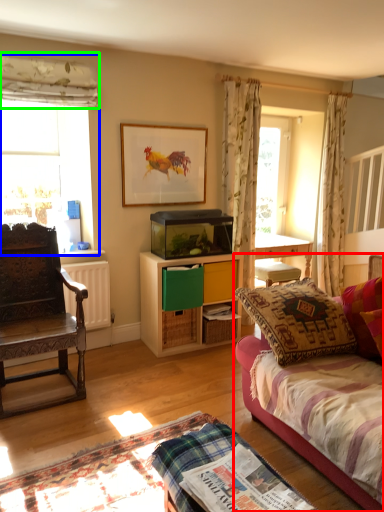
Question: Which object is the farthest from studio couch (highlighted by a red box)? Choose among these: window (highlighted by a blue box) or curtain (highlighted by a green box).

Choices:
 (A) window
 (B) curtain

Answer: (B)